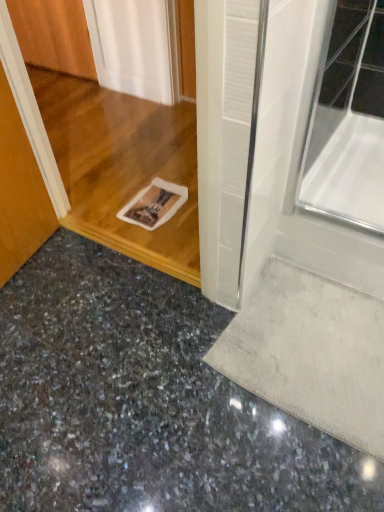
Locate an element on the screen. The width and height of the screenshot is (384, 512). polished granite floor at lower left is located at coordinates (145, 402).

Image resolution: width=384 pixels, height=512 pixels. Describe the element at coordinates (145, 402) in the screenshot. I see `polished granite floor at lower left` at that location.

I want to click on white textured mat at lower right, so click(x=310, y=353).

What is the approximate height of white textured mat at lower right?

white textured mat at lower right is 0.79 inches in height.

What is the approximate width of white textured mat at lower right?

white textured mat at lower right is 20.46 inches in width.

Image resolution: width=384 pixels, height=512 pixels. What do you see at coordinates (310, 353) in the screenshot? I see `white textured mat at lower right` at bounding box center [310, 353].

The width and height of the screenshot is (384, 512). In order to click on polished granite floor at lower left in this screenshot , I will do `click(145, 402)`.

Which is more to the left, white textured mat at lower right or polished granite floor at lower left?

From the viewer's perspective, polished granite floor at lower left appears more on the left side.

Is white textured mat at lower right in front of or behind polished granite floor at lower left in the image?

Visually, white textured mat at lower right is located behind polished granite floor at lower left.

Between point (343, 359) and point (35, 304), which one is positioned in front?

Positioned in front is point (343, 359).

From the image's perspective, which is below, white textured mat at lower right or polished granite floor at lower left?

polished granite floor at lower left.

From a real-world perspective, which object stands above the other?

From a 3D spatial view, white textured mat at lower right is above.

Which of these two, white textured mat at lower right or polished granite floor at lower left, is thinner?

white textured mat at lower right.

Looking at this image, considering the sizes of objects white textured mat at lower right and polished granite floor at lower left in the image provided, who is taller, white textured mat at lower right or polished granite floor at lower left?

With more height is polished granite floor at lower left.

Is white textured mat at lower right bigger or smaller than polished granite floor at lower left?

Considering their sizes, white textured mat at lower right takes up less space than polished granite floor at lower left.

Would you say polished granite floor at lower left is part of white textured mat at lower right's contents?

Definitely not — polished granite floor at lower left is not inside white textured mat at lower right.

Is white textured mat at lower right placed right next to polished granite floor at lower left?

white textured mat at lower right is not next to polished granite floor at lower left, and they're not touching.

Is white textured mat at lower right facing towards polished granite floor at lower left?

Yes, white textured mat at lower right faces towards polished granite floor at lower left.

In the scene shown: What's the angular difference between white textured mat at lower right and polished granite floor at lower left's facing directions?

The facing directions of white textured mat at lower right and polished granite floor at lower left are 180 degrees apart.

Measure the distance between white textured mat at lower right and polished granite floor at lower left.

white textured mat at lower right is 9.61 inches from polished granite floor at lower left.

Locate an element on the screen. doormat located above the polished granite floor at lower left (from a real-world perspective) is located at coordinates (310, 353).

Considering the positions of objects polished granite floor at lower left and white textured mat at lower right in the image provided, who is more to the left, polished granite floor at lower left or white textured mat at lower right?

Positioned to the left is polished granite floor at lower left.

Which is behind, polished granite floor at lower left or white textured mat at lower right?

white textured mat at lower right is further from the camera.

Does point (254, 400) lie behind point (309, 303)?

That is False.

From the image's perspective, who appears lower, polished granite floor at lower left or white textured mat at lower right?

polished granite floor at lower left appears lower in the image.

From a real-world perspective, which is physically above, polished granite floor at lower left or white textured mat at lower right?

In real-world perspective, white textured mat at lower right is above.

Considering the sizes of objects polished granite floor at lower left and white textured mat at lower right in the image provided, who is wider, polished granite floor at lower left or white textured mat at lower right?

polished granite floor at lower left is wider.

Is polished granite floor at lower left shorter than white textured mat at lower right?

In fact, polished granite floor at lower left may be taller than white textured mat at lower right.

Does polished granite floor at lower left have a larger size compared to white textured mat at lower right?

Yes.

Choose the correct answer: Is polished granite floor at lower left inside white textured mat at lower right or outside it?

polished granite floor at lower left is not inside white textured mat at lower right, it's outside.

Is there a large distance between polished granite floor at lower left and white textured mat at lower right?

polished granite floor at lower left is actually quite close to white textured mat at lower right.

Is polished granite floor at lower left positioned with its back to white textured mat at lower right?

No, polished granite floor at lower left's orientation is not away from white textured mat at lower right.

The width and height of the screenshot is (384, 512). What are the coordinates of `concrete that appears below the white textured mat at lower right (from a real-world perspective)` in the screenshot? It's located at point(145,402).

This screenshot has height=512, width=384. Identify the location of concrete that is on the left side of white textured mat at lower right. (145, 402).

Identify the location of concrete below the white textured mat at lower right (from the image's perspective). (145, 402).